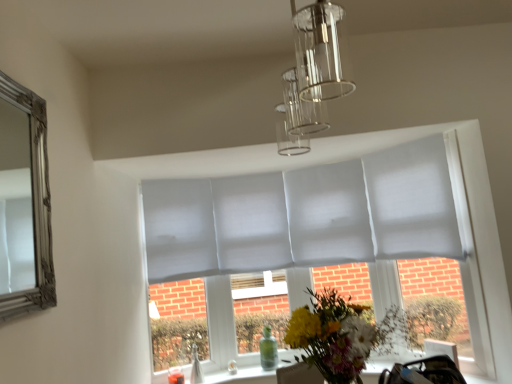
Question: Is transparent glass vase at lower center, arranged as the 2th glass vase when viewed from the front, facing away from fluffy bouquet at center?

Choices:
 (A) no
 (B) yes

Answer: (A)

Question: From a real-world perspective, is transparent glass vase at lower center, which is the 1th glass vase in right-to-left order, physically above fluffy bouquet at center?

Choices:
 (A) yes
 (B) no

Answer: (B)

Question: Is transparent glass vase at lower center, arranged as the 2th glass vase when viewed from the front, positioned in front of fluffy bouquet at center?

Choices:
 (A) yes
 (B) no

Answer: (B)

Question: Is transparent glass vase at lower center, which ranks as the 1th glass vase in back-to-front order, wider than fluffy bouquet at center?

Choices:
 (A) no
 (B) yes

Answer: (A)

Question: Considering the relative sizes of transparent glass vase at lower center, which ranks as the 1th glass vase in back-to-front order, and fluffy bouquet at center in the image provided, is transparent glass vase at lower center, which ranks as the 1th glass vase in back-to-front order, taller than fluffy bouquet at center?

Choices:
 (A) yes
 (B) no

Answer: (B)

Question: Can you confirm if transparent glass vase at lower center, the 2th glass vase viewed from the left, is smaller than fluffy bouquet at center?

Choices:
 (A) no
 (B) yes

Answer: (B)

Question: Is fluffy bouquet at center behind transparent glass vase at lower center, which ranks as the 1th glass vase in back-to-front order?

Choices:
 (A) yes
 (B) no

Answer: (B)

Question: Is fluffy bouquet at center aimed at transparent glass vase at lower center, which ranks as the 1th glass vase in back-to-front order?

Choices:
 (A) no
 (B) yes

Answer: (A)

Question: Is transparent glass vase at lower center, which is the 1th glass vase in right-to-left order, inside fluffy bouquet at center?

Choices:
 (A) yes
 (B) no

Answer: (B)

Question: Are fluffy bouquet at center and transparent glass vase at lower center, which is the 1th glass vase in right-to-left order, making contact?

Choices:
 (A) yes
 (B) no

Answer: (B)

Question: From a real-world perspective, is fluffy bouquet at center located higher than transparent glass vase at lower center, which is the 1th glass vase in right-to-left order?

Choices:
 (A) no
 (B) yes

Answer: (B)

Question: From the image's perspective, is fluffy bouquet at center beneath transparent glass vase at lower center, which is the 1th glass vase in right-to-left order?

Choices:
 (A) yes
 (B) no

Answer: (B)

Question: Would you say clear glass vase at lower center, marked as the second glass vase in a back-to-front arrangement, contains transparent glass vase at lower center, the 2th glass vase viewed from the left?

Choices:
 (A) no
 (B) yes

Answer: (A)